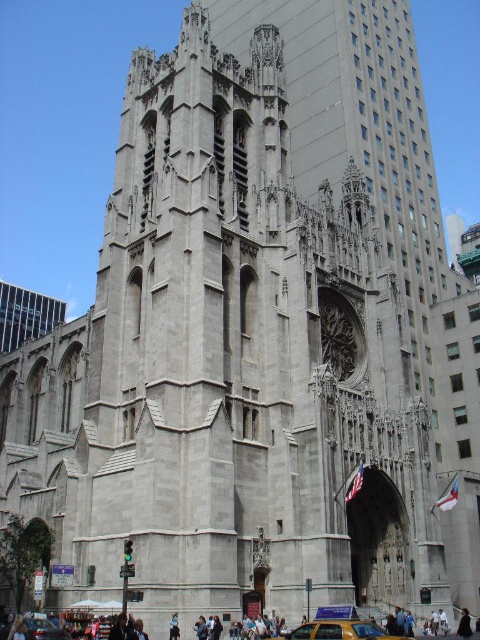
You are a tour guide leading a group to the cathedral entrance. You notice two yellow taxis parked at lower center. How far apart are the yellow matte taxi at lower center and the yellow metallic taxi cab at lower center?

The yellow matte taxi at lower center is 54.38 feet from the yellow metallic taxi cab at lower center.

You are a tourist standing in front of the cathedral and want to take a photo of the black leather jacket at lower right without the yellow matte taxi at lower center blocking the view. Is the taxi currently blocking the jacket?

The yellow matte taxi at lower center is positioned over black leather jacket at lower right, so yes, the taxi is blocking the jacket and you cannot take a photo of the black leather jacket at lower right without the taxi in the frame.

You are a tourist standing in front of the cathedral and want to take a photo of both the yellow matte taxi at lower center and the yellow metallic taxi cab at lower center in your camera frame. Which taxi should you focus on first to ensure both fit in the photo?

You should focus on the yellow metallic taxi cab at lower center first because it is smaller in size than the yellow matte taxi at lower center, allowing both to fit within the camera frame when positioned appropriately.